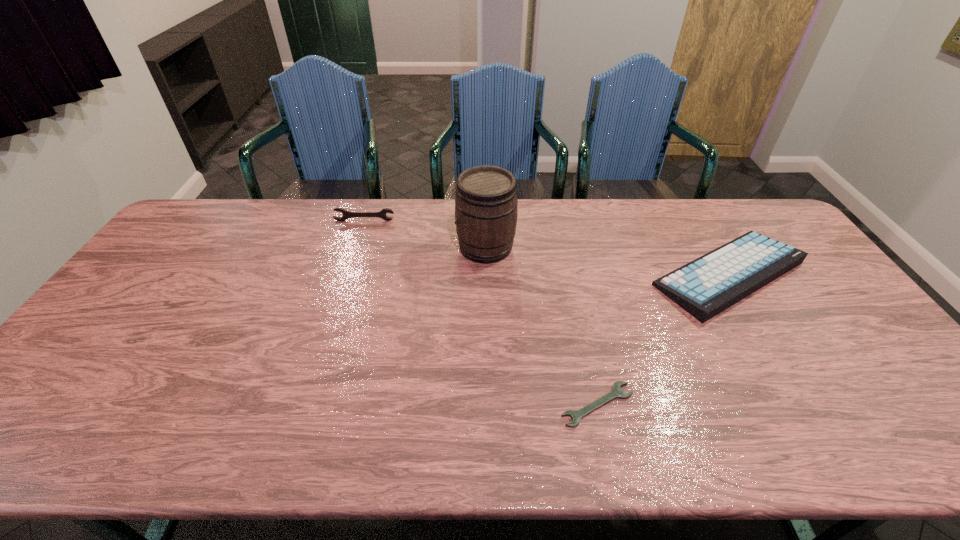
The image size is (960, 540). What are the coordinates of `vacant space that satisfies the following two spatial constraints: 1. on the open ends of the nearest object; 2. on the right side of the leftmost object` in the screenshot? It's located at (305, 404).